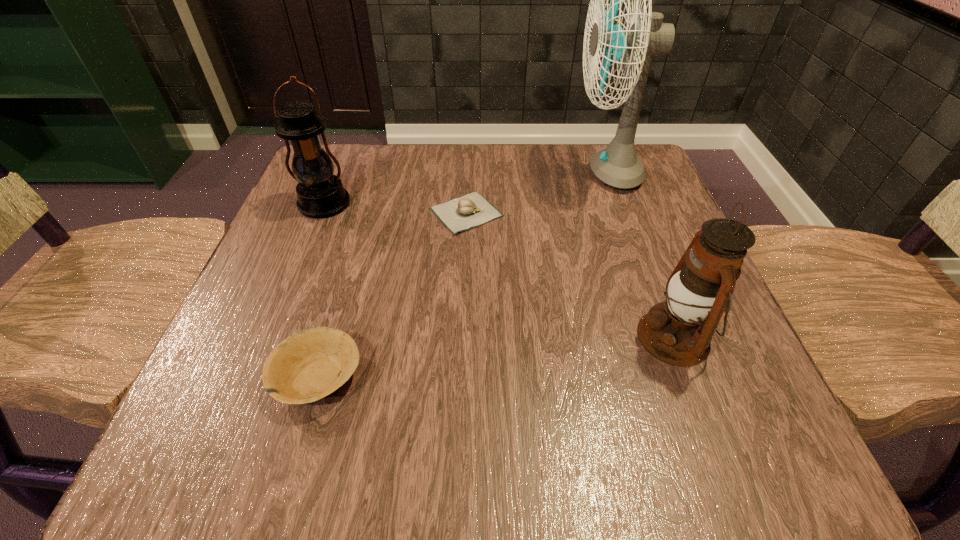
Where is `vacant space at the far left corner of the desktop`? This screenshot has width=960, height=540. vacant space at the far left corner of the desktop is located at coordinates (348, 179).

Locate an element on the screen. vacant space at the near left corner is located at coordinates (243, 444).

The height and width of the screenshot is (540, 960). What are the coordinates of `vacant space at the far right corner` in the screenshot? It's located at (611, 200).

Locate an element on the screen. This screenshot has width=960, height=540. free space at the near right corner is located at coordinates (707, 461).

Locate an element on the screen. Image resolution: width=960 pixels, height=540 pixels. vacant area that lies between the second shortest object and the right lantern is located at coordinates (495, 357).

You are a GUI agent. You are given a task and a screenshot of the screen. Output one action in this format:
    pyautogui.click(x=<x>, y=<y>)
    Task: Click on the free space between the second shortest object and the right lantern
    The height and width of the screenshot is (540, 960).
    Given the screenshot: What is the action you would take?
    point(495,357)

Image resolution: width=960 pixels, height=540 pixels. In order to click on free space between the fan and the right lantern in this screenshot , I will do `click(639, 254)`.

Identify the location of vacant space that's between the right lantern and the farther lantern. (498, 271).

Locate an element on the screen. Image resolution: width=960 pixels, height=540 pixels. vacant space in between the second shortest object and the fan is located at coordinates (462, 274).

At what (x,y) coordinates should I click in order to perform the action: click on blank region between the nearer lantern and the farther lantern. Please return your answer as a coordinate pair (x, y). The height and width of the screenshot is (540, 960). Looking at the image, I should click on (498, 271).